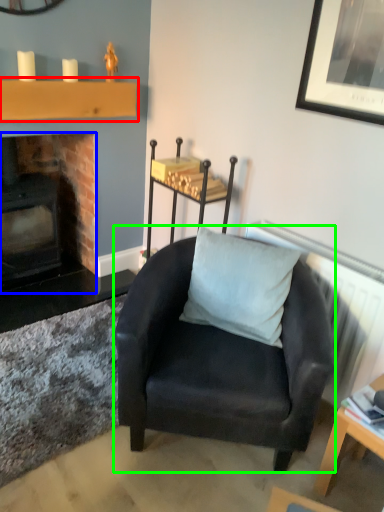
Question: Estimate the real-world distances between objects in this image. Which object is farther from shelf (highlighted by a red box), fireplace (highlighted by a blue box) or chair (highlighted by a green box)?

Choices:
 (A) fireplace
 (B) chair

Answer: (B)